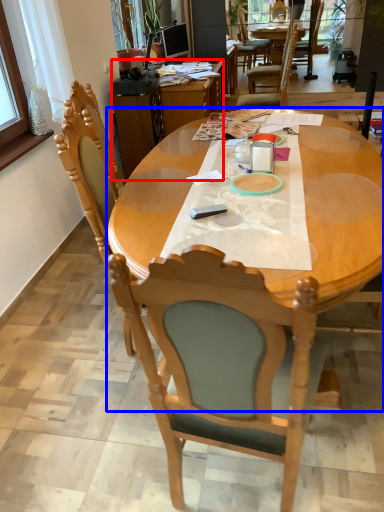
Question: Which object appears farthest to the camera in this image, desk (highlighted by a red box) or kitchen & dining room table (highlighted by a blue box)?

Choices:
 (A) desk
 (B) kitchen & dining room table

Answer: (A)